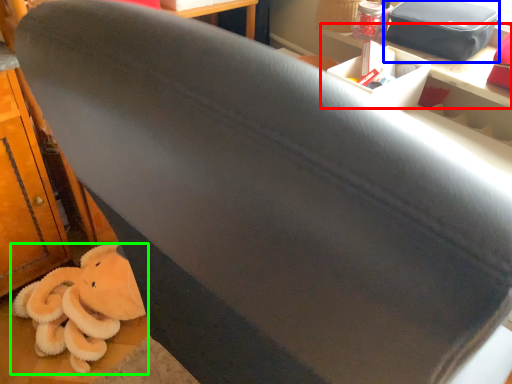
Question: Considering the real-world distances, which object is closest to table (highlighted by a red box)? kit (highlighted by a blue box) or toy (highlighted by a green box).

Choices:
 (A) kit
 (B) toy

Answer: (A)